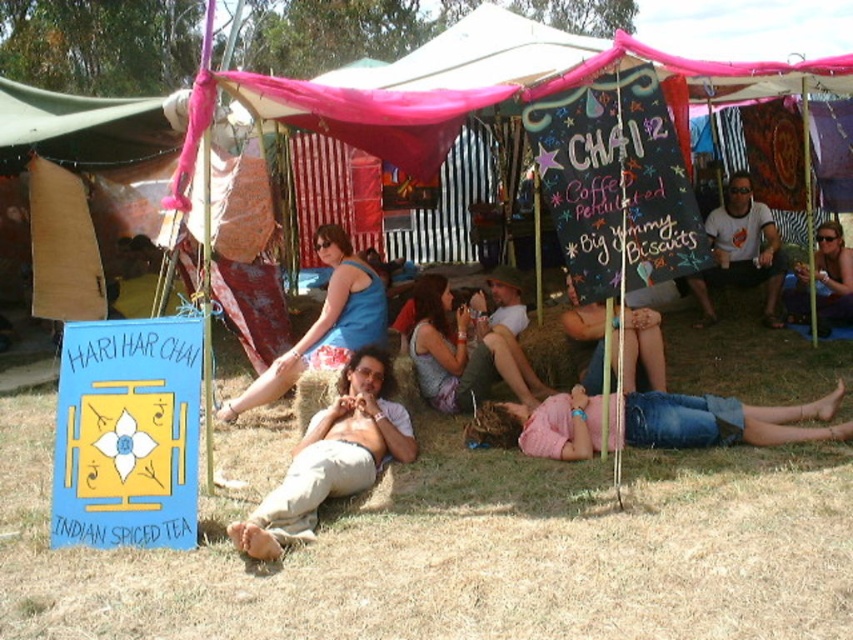
You are a photographer setting up a tripod in the lower center area of the scene. The tripod requires a space that is at least as wide as the tan cotton pants at center. Can the brown dry grass at lower center accommodate the tripod?

The brown dry grass at lower center might be wider than the tan cotton pants at center, so it could potentially accommodate the tripod, but there is uncertainty due to the comparative width.

You are a photographer at the festival and want to capture both the brown dry grass at lower center and the tan cotton pants at center in a single frame. Which object should you focus on first to ensure both are in the frame?

You should focus on the brown dry grass at lower center first because it is larger in size compared to the tan cotton pants at center, allowing both to fit within the frame more easily.

Based on the scene description, what is the exact 2D coordinate of the brown dry grass at lower center?

The exact 2D coordinate of the brown dry grass at lower center is at point (457, 548).